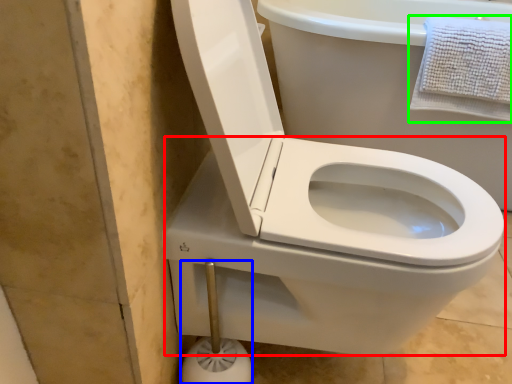
Question: Estimate the real-world distances between objects in this image. Which object is closer to bidet (highlighted by a red box), towel bar (highlighted by a blue box) or bath towel (highlighted by a green box)?

Choices:
 (A) towel bar
 (B) bath towel

Answer: (A)